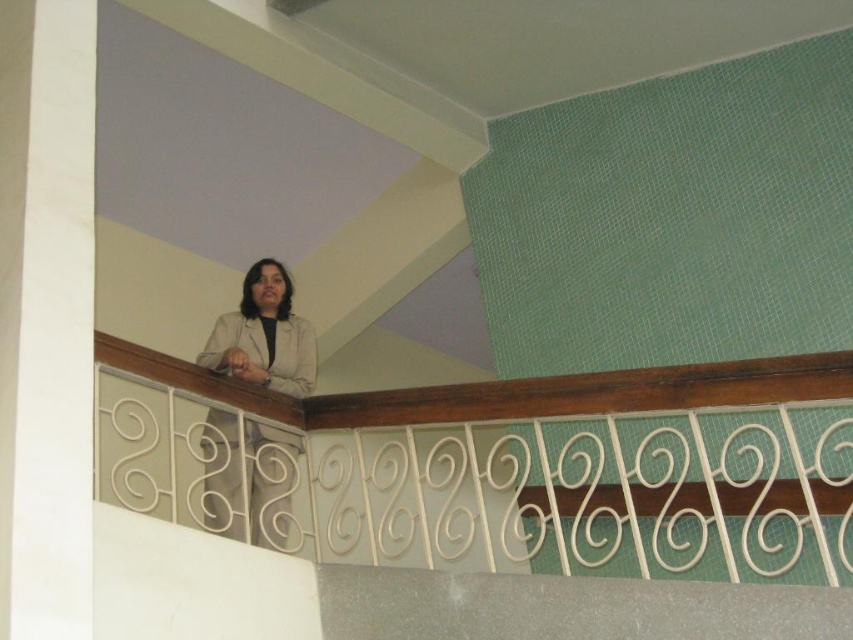
What do you see at coordinates (264, 336) in the screenshot? The height and width of the screenshot is (640, 853). I see `matte beige jacket at upper center` at bounding box center [264, 336].

Who is higher up, matte beige jacket at upper center or beige fabric lab coat at center?

beige fabric lab coat at center is above.

Between point (231, 509) and point (264, 433), which one is positioned behind?

The point (264, 433) is more distant.

Where is `matte beige jacket at upper center`? matte beige jacket at upper center is located at coordinates (264, 336).